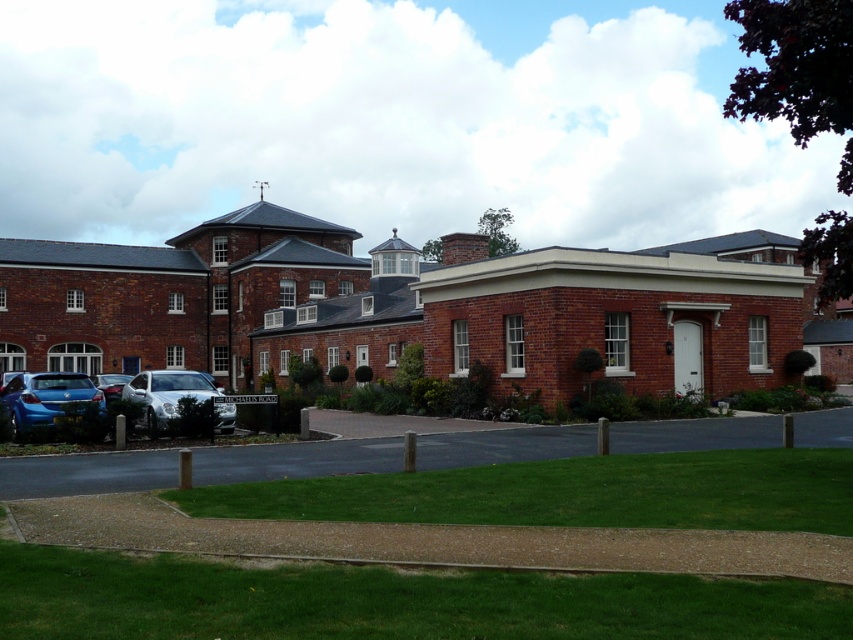
Describe the element at coordinates (166, 392) in the screenshot. I see `satin silver car at center` at that location.

Is satin silver car at center below metallic silver car at center-left?

Actually, satin silver car at center is above metallic silver car at center-left.

In order to click on satin silver car at center in this screenshot , I will do `click(166, 392)`.

You are a GUI agent. You are given a task and a screenshot of the screen. Output one action in this format:
    pyautogui.click(x=<x>, y=<y>)
    Task: Click on the satin silver car at center
    This screenshot has height=640, width=853.
    Given the screenshot: What is the action you would take?
    pyautogui.click(x=166, y=392)

Consider the image. Does metallic blue sedan at lower left appear on the right side of satin silver car at center?

Yes, metallic blue sedan at lower left is to the right of satin silver car at center.

This screenshot has height=640, width=853. What do you see at coordinates (45, 400) in the screenshot? I see `metallic blue sedan at lower left` at bounding box center [45, 400].

In order to click on metallic blue sedan at lower left in this screenshot , I will do `click(45, 400)`.

Locate an element on the screen. metallic blue sedan at lower left is located at coordinates (45, 400).

Does metallic blue sedan at lower left appear over metallic silver car at center-left?

Yes.

Is point (27, 392) positioned before point (119, 385)?

Yes, point (27, 392) is closer to viewer.

Locate an element on the screen. The image size is (853, 640). metallic blue sedan at lower left is located at coordinates (45, 400).